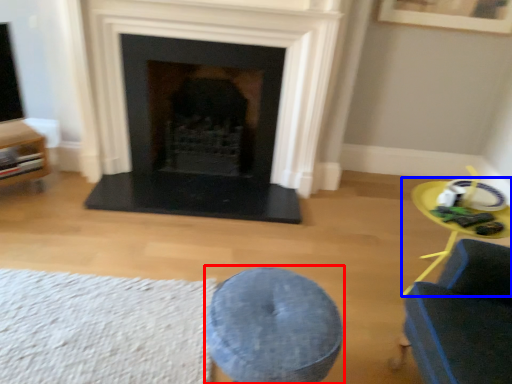
Question: Among these objects, which one is nearest to the camera, bar stool (highlighted by a red box) or round table (highlighted by a blue box)?

Choices:
 (A) bar stool
 (B) round table

Answer: (A)